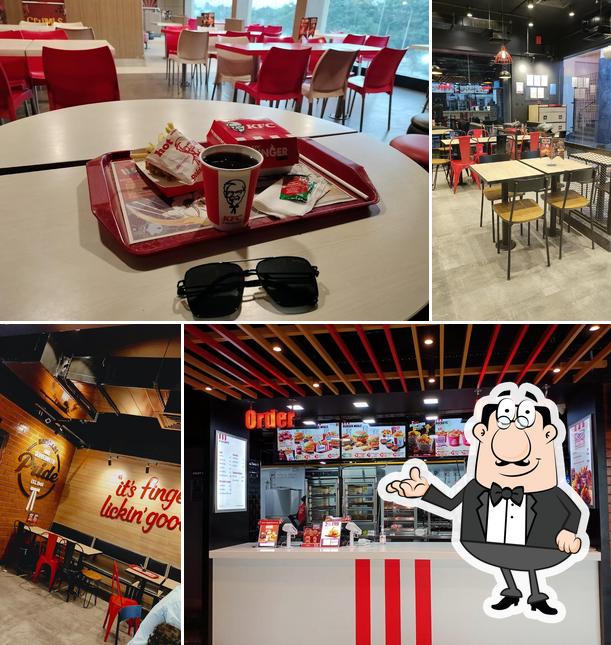
Where is `chairs`? chairs is located at coordinates (533, 204), (580, 202), (461, 163), (499, 148), (530, 151), (118, 593), (126, 618), (67, 573), (44, 560), (19, 551).